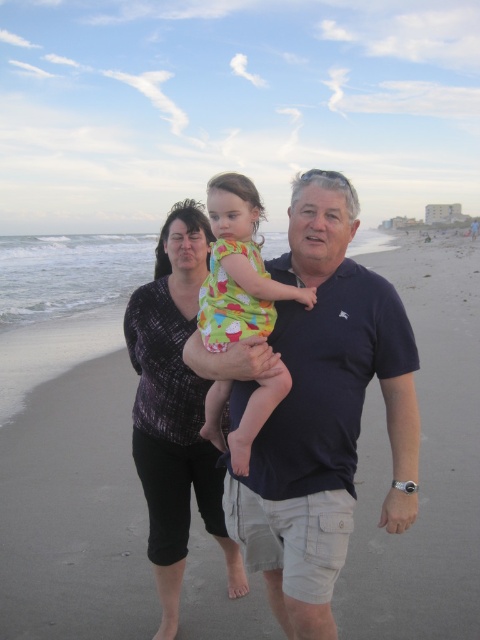
You are a photographer trying to capture a photo of the family. The camera you are using has a limited field of view. Given that the beige sand at center is wider than the dark blue cotton polo shirt at center, which object should you focus on to ensure both the sand and the polo shirt are fully visible in the frame?

You should focus on the beige sand at center since it is wider than the dark blue cotton polo shirt at center, ensuring both fit within the camera frame.

You are a photographer trying to capture the family on the beach. To ensure the beige sand at center is in focus, where should you position your camera lens focus point?

The beige sand at center is located at point (x=423, y=461), so you should position your camera lens focus point at that coordinate to ensure it is in focus.